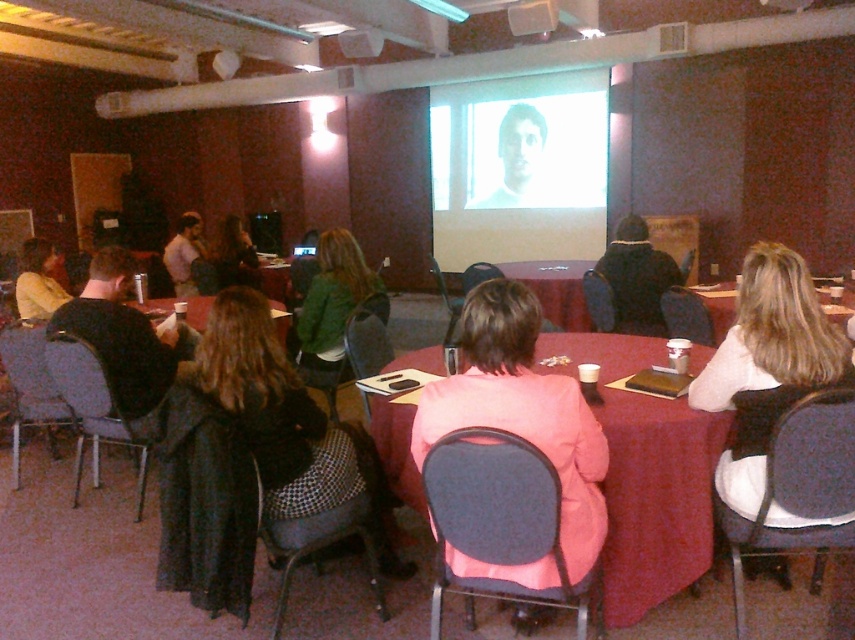
Is dark brown hair at center smaller than smooth black table at center?

Indeed, dark brown hair at center has a smaller size compared to smooth black table at center.

Which is more to the left, dark brown hair at center or smooth black table at center?

smooth black table at center is more to the left.

What do you see at coordinates (234, 256) in the screenshot?
I see `dark brown hair at center` at bounding box center [234, 256].

The width and height of the screenshot is (855, 640). Identify the location of dark brown hair at center. (234, 256).

Who is more distant from viewer, (800, 368) or (234, 227)?

Positioned behind is point (234, 227).

Is point (736, 456) farther from viewer compared to point (227, 234)?

No, it is in front of (227, 234).

Locate an element on the screen. blonde hair at center is located at coordinates (767, 365).

What are the coordinates of `blonde hair at center` in the screenshot? It's located at (767, 365).

Does point (606, 497) lie in front of point (544, 108)?

Yes, point (606, 497) is closer to viewer.

Who is taller, maroon fabric table at center or white glossy projection screen at upper center?

white glossy projection screen at upper center is taller.

Identify the location of maroon fabric table at center. This screenshot has height=640, width=855. (646, 474).

At what (x,y) coordinates should I click in order to perform the action: click on maroon fabric table at center. Please return your answer as a coordinate pair (x, y). Image resolution: width=855 pixels, height=640 pixels. Looking at the image, I should click on pos(646,474).